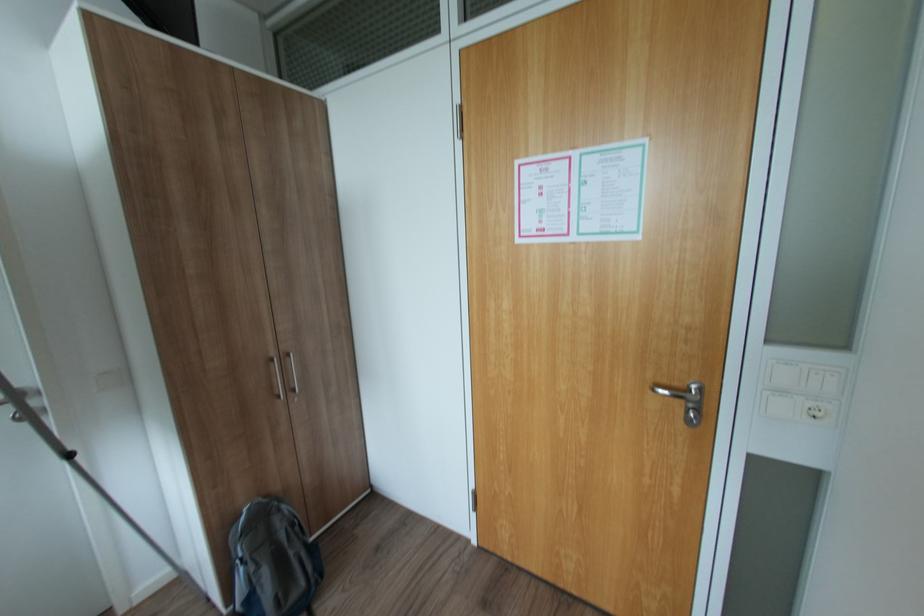
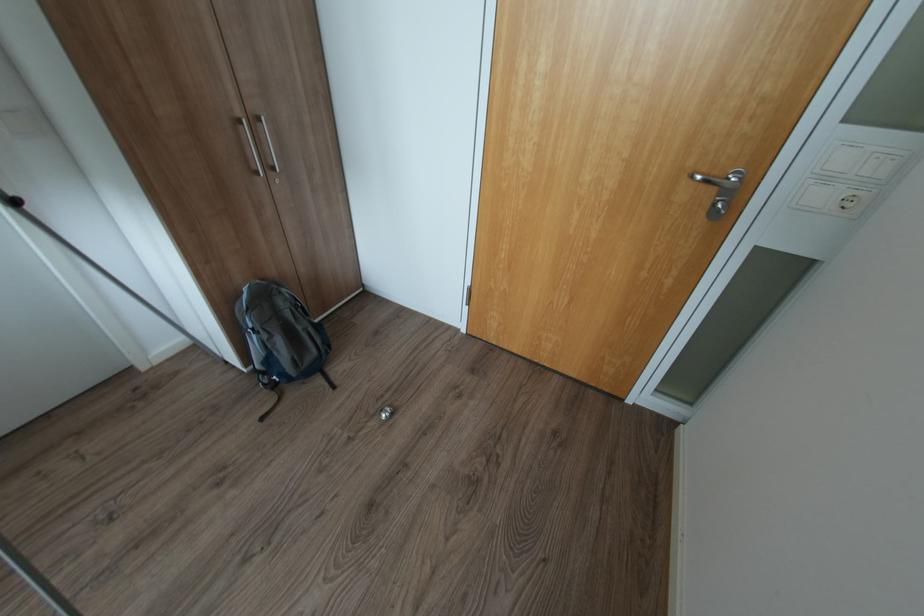
Which direction would the cameraman need to move to produce the second image?

The cameraman walked toward left, forward.